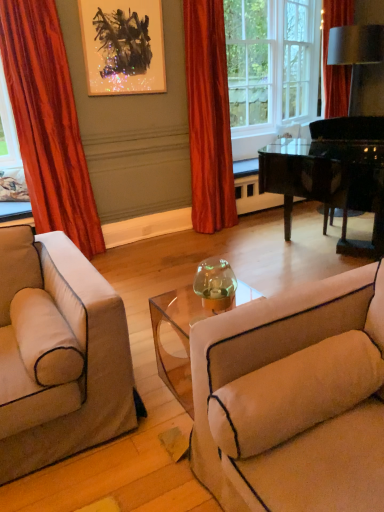
At what (x,y) coordinates should I click in order to perform the action: click on beige fabric couch at lower right. Please return your answer as a coordinate pair (x, y). Looking at the image, I should click on (293, 398).

Where is `metallic abstract art at upper center`? metallic abstract art at upper center is located at coordinates (123, 46).

Locate an element on the screen. The image size is (384, 512). beige fabric couch at lower right is located at coordinates (293, 398).

Is velvet orange curtain at left, acting as the first curtain starting from the left, smaller than metallic abstract art at upper center?

Incorrect, velvet orange curtain at left, acting as the first curtain starting from the left, is not smaller in size than metallic abstract art at upper center.

Do you think velvet orange curtain at left, acting as the first curtain starting from the left, is within metallic abstract art at upper center, or outside of it?

velvet orange curtain at left, acting as the first curtain starting from the left, lies outside metallic abstract art at upper center.

Is velvet orange curtain at left, the second curtain from the right, shorter than metallic abstract art at upper center?

No, velvet orange curtain at left, the second curtain from the right, is not shorter than metallic abstract art at upper center.

Between velvet orange curtain at left, the second curtain from the right, and metallic abstract art at upper center, which one appears on the left side from the viewer's perspective?

velvet orange curtain at left, the second curtain from the right, is more to the left.

In the scene shown: Considering the sizes of objects black glossy piano at center right and silky orange curtain at center, which is the 1th curtain from right to left, in the image provided, who is taller, black glossy piano at center right or silky orange curtain at center, which is the 1th curtain from right to left,?

silky orange curtain at center, which is the 1th curtain from right to left.

Is black glossy piano at center right facing away from silky orange curtain at center, which is the 1th curtain from right to left?

No, silky orange curtain at center, which is the 1th curtain from right to left, is not at the back of black glossy piano at center right.

Is black glossy piano at center right positioned far away from silky orange curtain at center, acting as the 2th curtain starting from the left?

Absolutely, black glossy piano at center right is distant from silky orange curtain at center, acting as the 2th curtain starting from the left.

Choose the correct answer: Is beige fabric couch at lower right inside silky orange curtain at center, acting as the 2th curtain starting from the left, or outside it?

beige fabric couch at lower right is outside silky orange curtain at center, acting as the 2th curtain starting from the left.

Can you confirm if beige fabric couch at lower right is positioned to the left of silky orange curtain at center, acting as the 2th curtain starting from the left?

In fact, beige fabric couch at lower right is to the right of silky orange curtain at center, acting as the 2th curtain starting from the left.

Locate an element on the screen. studio couch located below the white glass window frame at upper center (from the image's perspective) is located at coordinates (293, 398).

Is beige fabric couch at lower right outside of white glass window frame at upper center?

Yes, beige fabric couch at lower right is not within white glass window frame at upper center.

Which is behind, point (285, 402) or point (316, 78)?

The point (316, 78) is behind.

Could metallic abstract art at upper center be considered to be inside silky orange curtain at center, which is the 1th curtain from right to left?

Definitely not — metallic abstract art at upper center is not inside silky orange curtain at center, which is the 1th curtain from right to left.

From the image's perspective, is silky orange curtain at center, acting as the 2th curtain starting from the left, positioned above or below metallic abstract art at upper center?

From the image's perspective, silky orange curtain at center, acting as the 2th curtain starting from the left, appears below metallic abstract art at upper center.

Would you consider silky orange curtain at center, which is the 1th curtain from right to left, to be distant from metallic abstract art at upper center?

No.

Can you confirm if silky orange curtain at center, which is the 1th curtain from right to left, is positioned to the left of metallic abstract art at upper center?

No.

Are white glass window frame at upper center and velvet orange curtain at left, the second curtain from the right, beside each other?

No, white glass window frame at upper center is not with velvet orange curtain at left, the second curtain from the right.

From the image's perspective, is white glass window frame at upper center on top of velvet orange curtain at left, acting as the first curtain starting from the left?

Correct, white glass window frame at upper center appears higher than velvet orange curtain at left, acting as the first curtain starting from the left, in the image.

In the image, is white glass window frame at upper center positioned in front of or behind velvet orange curtain at left, acting as the first curtain starting from the left?

white glass window frame at upper center is behind velvet orange curtain at left, acting as the first curtain starting from the left.

From a real-world perspective, which object rests below the other?

velvet orange curtain at left, the second curtain from the right, is physically lower.

Looking at this image, considering the sizes of objects black glossy piano at center right and beige fabric couch at lower right in the image provided, who is wider, black glossy piano at center right or beige fabric couch at lower right?

black glossy piano at center right is wider.

Is black glossy piano at center right facing away from beige fabric couch at lower right?

No.

Would you consider black glossy piano at center right to be distant from beige fabric couch at lower right?

Yes, black glossy piano at center right and beige fabric couch at lower right are quite far apart.

Locate an element on the screen. The height and width of the screenshot is (512, 384). studio couch below the black glossy piano at center right (from a real-world perspective) is located at coordinates tap(293, 398).

You are a GUI agent. You are given a task and a screenshot of the screen. Output one action in this format:
    pyautogui.click(x=<x>, y=<y>)
    Task: Click on the 2nd curtain positioned below the metallic abstract art at upper center (from the image's perspective)
    This screenshot has width=384, height=512.
    Given the screenshot: What is the action you would take?
    pyautogui.click(x=48, y=123)

This screenshot has height=512, width=384. I want to click on piano below the silky orange curtain at center, acting as the 2th curtain starting from the left (from a real-world perspective), so click(332, 175).

Which object lies nearer to the anchor point silky orange curtain at center, acting as the 2th curtain starting from the left, velvet orange curtain at left, acting as the first curtain starting from the left, or black glossy piano at center right?

The object closer to silky orange curtain at center, acting as the 2th curtain starting from the left, is black glossy piano at center right.

Which object lies further to the anchor point white glass window frame at upper center, velvet orange curtain at left, the second curtain from the right, or black glossy piano at center right?

The object further to white glass window frame at upper center is velvet orange curtain at left, the second curtain from the right.

From the picture: Based on their spatial positions, is white glass window frame at upper center or silky orange curtain at center, which is the 1th curtain from right to left, further from black glossy piano at center right?

white glass window frame at upper center.

Looking at the image, which one is located further to metallic abstract art at upper center, silky orange curtain at center, acting as the 2th curtain starting from the left, or beige fabric couch at lower right?

beige fabric couch at lower right.

Looking at the image, which one is located closer to beige fabric couch at lower right, metallic abstract art at upper center or velvet orange curtain at left, the second curtain from the right?

velvet orange curtain at left, the second curtain from the right, lies closer to beige fabric couch at lower right than the other object.

Looking at the image, which one is located closer to velvet orange curtain at left, acting as the first curtain starting from the left, white glass window frame at upper center or beige fabric couch at lower right?

Based on the image, beige fabric couch at lower right appears to be nearer to velvet orange curtain at left, acting as the first curtain starting from the left.

Looking at the image, which one is located closer to silky orange curtain at center, which is the 1th curtain from right to left, black glossy piano at center right or beige fabric couch at lower right?

Among the two, black glossy piano at center right is located nearer to silky orange curtain at center, which is the 1th curtain from right to left.

Based on their spatial positions, is beige fabric couch at lower right or white glass window frame at upper center closer to metallic abstract art at upper center?

white glass window frame at upper center is positioned closer to the anchor metallic abstract art at upper center.

The height and width of the screenshot is (512, 384). I want to click on picture frame positioned between beige fabric couch at lower right and white glass window frame at upper center from near to far, so click(123, 46).

At what (x,y) coordinates should I click in order to perform the action: click on curtain between beige fabric couch at lower right and metallic abstract art at upper center from front to back. Please return your answer as a coordinate pair (x, y). Looking at the image, I should click on (48, 123).

The width and height of the screenshot is (384, 512). Find the location of `piano located between beige fabric couch at lower right and metallic abstract art at upper center in the depth direction`. piano located between beige fabric couch at lower right and metallic abstract art at upper center in the depth direction is located at coordinates (332, 175).

Locate an element on the screen. piano located between velvet orange curtain at left, acting as the first curtain starting from the left, and white glass window frame at upper center in the left-right direction is located at coordinates (332, 175).